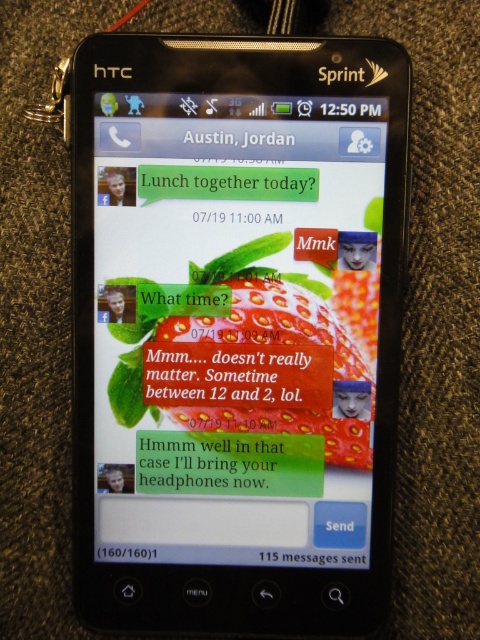
In the scene shown: You are holding the black plastic phone at center and want to place the matte plastic text message at center on top of it. Is there enough space between them for you to do this?

The distance between the black plastic phone at center and the matte plastic text message at center is 13.63 centimeters. Since you are placing the text message on top of the phone, the distance is sufficient as the text message will occupy the same space as the phone screen.